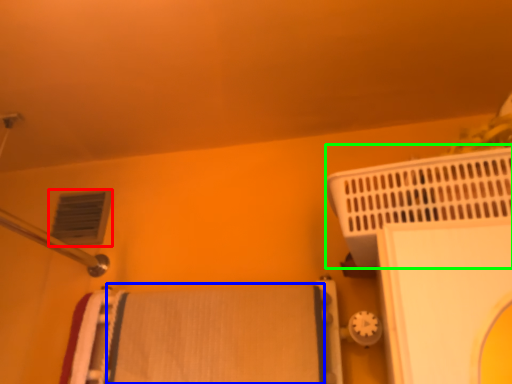
Question: Which object is the closest to the air conditioning (highlighted by a red box)? Choose among these: bath towel (highlighted by a blue box) or bath heater (highlighted by a green box).

Choices:
 (A) bath towel
 (B) bath heater

Answer: (A)